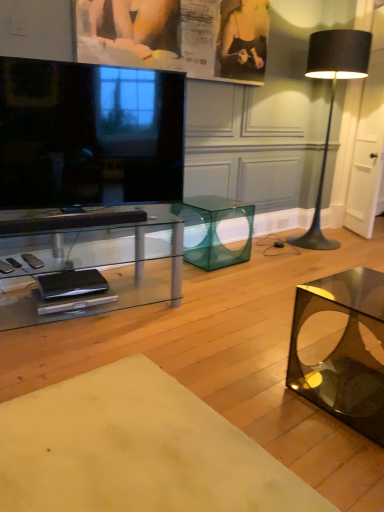
Describe the element at coordinates (89, 134) in the screenshot. I see `black glossy television at left` at that location.

Locate an element on the screen. black glossy television at left is located at coordinates (89, 134).

Describe the element at coordinates (177, 36) in the screenshot. I see `matte paper poster at upper center` at that location.

The height and width of the screenshot is (512, 384). Describe the element at coordinates (90, 263) in the screenshot. I see `clear glass table at center, which is the 2th table from back to front` at that location.

Where is `transparent glass cube at center, which appears as the third table when viewed from the front`? The height and width of the screenshot is (512, 384). transparent glass cube at center, which appears as the third table when viewed from the front is located at coordinates (215, 230).

Is black glossy television at left far from polished black glass cube at lower right?

Yes, black glossy television at left and polished black glass cube at lower right are located far from each other.

Considering the points (97, 123) and (322, 302), which point is in front, point (97, 123) or point (322, 302)?

Point (322, 302)

From a real-world perspective, is black glossy television at left on polished black glass cube at lower right?

Yes, from a real-world perspective, black glossy television at left is on top of polished black glass cube at lower right.

Is matte paper poster at upper center at the left side of clear glass table at center, which is the 2th table from back to front?

No, matte paper poster at upper center is not to the left of clear glass table at center, which is the 2th table from back to front.

Can you tell me how much matte paper poster at upper center and clear glass table at center, the second table positioned from the front, differ in facing direction?

The angular difference between matte paper poster at upper center and clear glass table at center, the second table positioned from the front, is 12.3 degrees.

From the picture: Is matte paper poster at upper center smaller than clear glass table at center, which is the 2th table from back to front?

Yes.

Which object is thinner, matte paper poster at upper center or clear glass table at center, which is the 2th table from back to front?

With smaller width is matte paper poster at upper center.

Is polished black glass cube at lower right spatially inside black glossy television at left, or outside of it?

polished black glass cube at lower right is not enclosed by black glossy television at left.

Considering the positions of objects polished black glass cube at lower right and black glossy television at left in the image provided, who is more to the left, polished black glass cube at lower right or black glossy television at left?

black glossy television at left.

Does polished black glass cube at lower right have a lesser width compared to black glossy television at left?

In fact, polished black glass cube at lower right might be wider than black glossy television at left.

Could transparent glass cube at center, which is the first table from back to front, be considered to be inside black matte floor lamp at right?

No.

Is point (309, 42) positioned after point (242, 247)?

Yes, point (309, 42) is farther from viewer.

Identify the location of the 1st table in front of the black matte floor lamp at right. This screenshot has width=384, height=512. click(215, 230).

From a real-world perspective, which object rests below the other?

transparent glass cube at center, which appears as the third table when viewed from the front.

Based on the photo, from the image's perspective, which is above, clear glass table at center, the second table positioned from the front, or polished black glass cube at lower right?

clear glass table at center, the second table positioned from the front, from the image's perspective.

From a real-world perspective, does clear glass table at center, the second table positioned from the front, sit lower than polished black glass cube at lower right?

No.

Can you tell me how much smooth cream fabric at lower center, acting as the 3th table starting from the back, and clear glass table at center, which is the 2th table from back to front, differ in facing direction?

The angle between the facing direction of smooth cream fabric at lower center, acting as the 3th table starting from the back, and the facing direction of clear glass table at center, which is the 2th table from back to front, is 11.9 degrees.

Is clear glass table at center, which is the 2th table from back to front, located within smooth cream fabric at lower center, acting as the 3th table starting from the back?

Definitely not — clear glass table at center, which is the 2th table from back to front, is not inside smooth cream fabric at lower center, acting as the 3th table starting from the back.

Which object is closer to the camera taking this photo, smooth cream fabric at lower center, acting as the 3th table starting from the back, or clear glass table at center, which is the 2th table from back to front?

Positioned in front is smooth cream fabric at lower center, acting as the 3th table starting from the back.

From the image's perspective, which one is positioned lower, smooth cream fabric at lower center, the 1th table when ordered from front to back, or clear glass table at center, which is the 2th table from back to front?

From the image's view, smooth cream fabric at lower center, the 1th table when ordered from front to back, is below.

Can you confirm if clear glass table at center, the second table positioned from the front, is bigger than black matte floor lamp at right?

Incorrect, clear glass table at center, the second table positioned from the front, is not larger than black matte floor lamp at right.

From a real-world perspective, which is physically above, clear glass table at center, the second table positioned from the front, or black matte floor lamp at right?

In real-world perspective, black matte floor lamp at right is above.

Which of these two, clear glass table at center, the second table positioned from the front, or black matte floor lamp at right, is wider?

With larger width is black matte floor lamp at right.

Measure the distance between clear glass table at center, which is the 2th table from back to front, and black matte floor lamp at right.

clear glass table at center, which is the 2th table from back to front, is 2.44 meters away from black matte floor lamp at right.

Identify the location of television behind the polished black glass cube at lower right. The width and height of the screenshot is (384, 512). (89, 134).

Which table is the 2nd one when counting from the left side of the matte paper poster at upper center? Please provide its 2D coordinates.

[(90, 263)]

When comparing their distances from black glossy television at left, does polished black glass cube at lower right or clear glass table at center, the second table positioned from the front, seem closer?

Among the two, clear glass table at center, the second table positioned from the front, is located nearer to black glossy television at left.

From the image, which object appears to be nearer to polished black glass cube at lower right, matte paper poster at upper center or clear glass table at center, which is the 2th table from back to front?

Among the two, clear glass table at center, which is the 2th table from back to front, is located nearer to polished black glass cube at lower right.

Which object lies nearer to the anchor point transparent glass cube at center, which appears as the third table when viewed from the front, smooth cream fabric at lower center, the 1th table when ordered from front to back, or black glossy television at left?

black glossy television at left lies closer to transparent glass cube at center, which appears as the third table when viewed from the front, than the other object.

Considering their positions, is transparent glass cube at center, which is the first table from back to front, positioned further to matte paper poster at upper center than smooth cream fabric at lower center, acting as the 3th table starting from the back?

smooth cream fabric at lower center, acting as the 3th table starting from the back, is positioned further to the anchor matte paper poster at upper center.

Looking at this image, which object lies further to the anchor point black matte floor lamp at right, black glossy television at left or smooth cream fabric at lower center, the 1th table when ordered from front to back?

The object further to black matte floor lamp at right is smooth cream fabric at lower center, the 1th table when ordered from front to back.

Based on the photo, estimate the real-world distances between objects in this image. Which object is further from transparent glass cube at center, which appears as the third table when viewed from the front, smooth cream fabric at lower center, acting as the 3th table starting from the back, or matte paper poster at upper center?

smooth cream fabric at lower center, acting as the 3th table starting from the back.

Based on their spatial positions, is smooth cream fabric at lower center, acting as the 3th table starting from the back, or black glossy television at left closer to clear glass table at center, which is the 2th table from back to front?

black glossy television at left is closer to clear glass table at center, which is the 2th table from back to front.

Considering their positions, is transparent glass cube at center, which is the first table from back to front, positioned closer to matte paper poster at upper center than black matte floor lamp at right?

black matte floor lamp at right lies closer to matte paper poster at upper center than the other object.

Find the location of a particular element. The width and height of the screenshot is (384, 512). television between matte paper poster at upper center and transparent glass cube at center, which appears as the third table when viewed from the front, in the up-down direction is located at coordinates (89, 134).

This screenshot has width=384, height=512. Identify the location of table between black glossy television at left and transparent glass cube at center, which is the first table from back to front, from front to back. (90, 263).

The height and width of the screenshot is (512, 384). Identify the location of coffee table positioned between smooth cream fabric at lower center, the 1th table when ordered from front to back, and transparent glass cube at center, which is the first table from back to front, from near to far. (341, 348).

You are a GUI agent. You are given a task and a screenshot of the screen. Output one action in this format:
    pyautogui.click(x=<x>, y=<y>)
    Task: Click on the lamp between matte paper poster at upper center and polished black glass cube at lower right from top to bottom
    
    Given the screenshot: What is the action you would take?
    pyautogui.click(x=332, y=102)